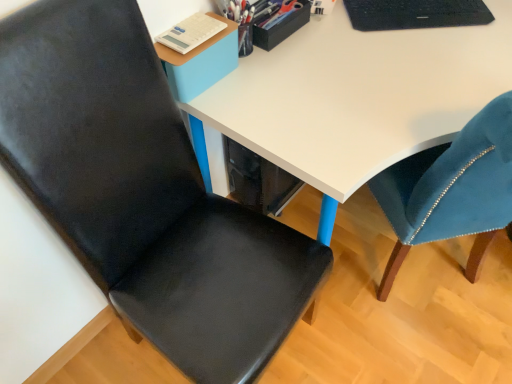
Image resolution: width=512 pixels, height=384 pixels. Find the location of `vacant area on top of metallic pen holder at upper center (from a real-world perspective)`. vacant area on top of metallic pen holder at upper center (from a real-world perspective) is located at coordinates (280, 14).